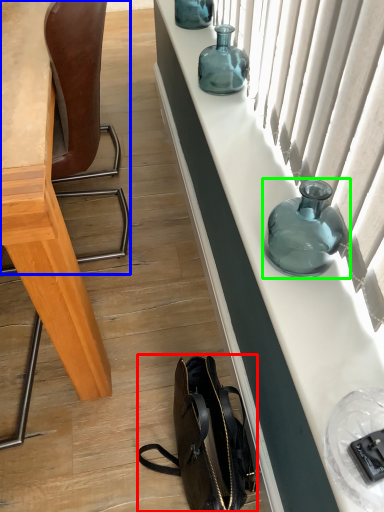
Question: Which object is the farthest from handbag (highlighted by a red box)? Choose among these: chair (highlighted by a blue box) or bottle (highlighted by a green box).

Choices:
 (A) chair
 (B) bottle

Answer: (A)